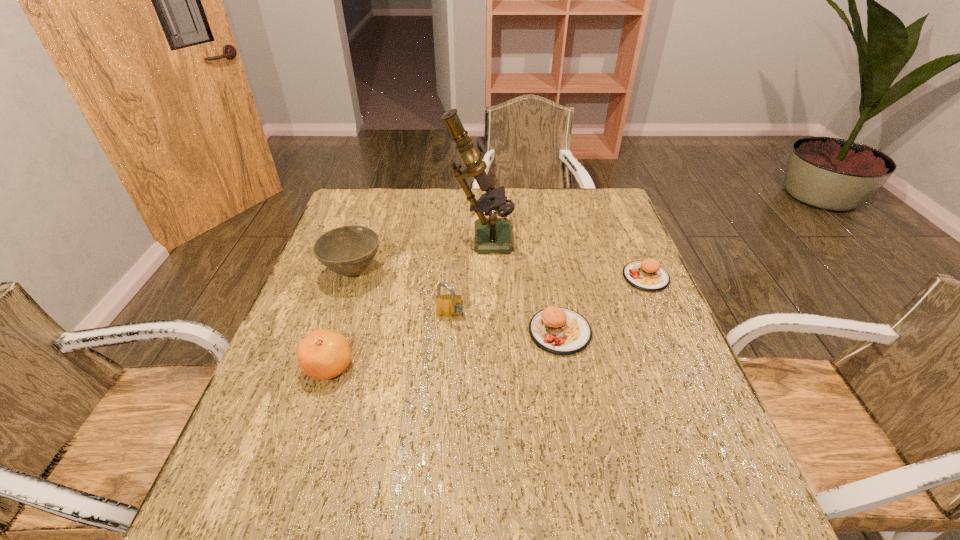
This screenshot has height=540, width=960. What are the coordinates of `the left patty` in the screenshot? It's located at pyautogui.click(x=561, y=331).

At what (x,y) coordinates should I click in order to perform the action: click on the taller patty. Please return your answer as a coordinate pair (x, y). Image resolution: width=960 pixels, height=540 pixels. Looking at the image, I should click on (561, 331).

In order to click on the shorter patty in this screenshot , I will do `click(647, 275)`.

At what (x,y) coordinates should I click in order to perform the action: click on the shortest object. Please return your answer as a coordinate pair (x, y). Image resolution: width=960 pixels, height=540 pixels. Looking at the image, I should click on (647, 275).

What are the coordinates of `bowl` in the screenshot? It's located at (348, 250).

In order to click on clementine in this screenshot , I will do `click(323, 354)`.

Find the location of a particular element. The image size is (960, 540). the tallest object is located at coordinates (492, 235).

Image resolution: width=960 pixels, height=540 pixels. I want to click on padlock, so click(x=449, y=305).

Locate an element on the screen. The image size is (960, 540). free location located on the left of the taller patty is located at coordinates (378, 332).

Identify the location of free region located 0.240m on the left of the shorter patty. The height and width of the screenshot is (540, 960). (535, 277).